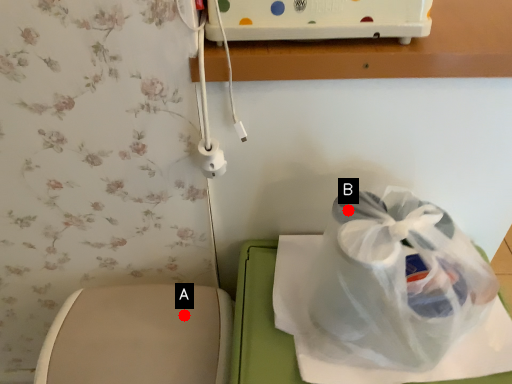
Question: Two points are circled on the image, labeled by A and B beside each circle. Which point is farther to the camera?

Choices:
 (A) A is further
 (B) B is further

Answer: (A)